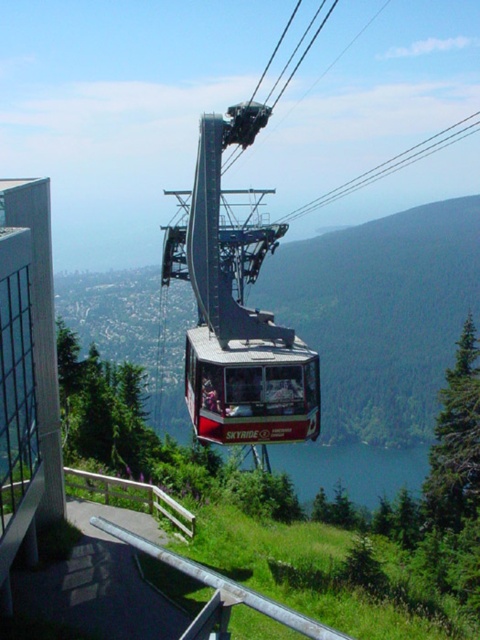
Question: Does red matte cable car at center appear over blue water at lower center?

Choices:
 (A) no
 (B) yes

Answer: (B)

Question: Is red matte cable car at center below blue water at lower center?

Choices:
 (A) no
 (B) yes

Answer: (A)

Question: Among these points, which one is farthest from the camera?

Choices:
 (A) (216, 401)
 (B) (372, 499)

Answer: (B)

Question: Does red matte cable car at center have a greater width compared to blue water at lower center?

Choices:
 (A) no
 (B) yes

Answer: (A)